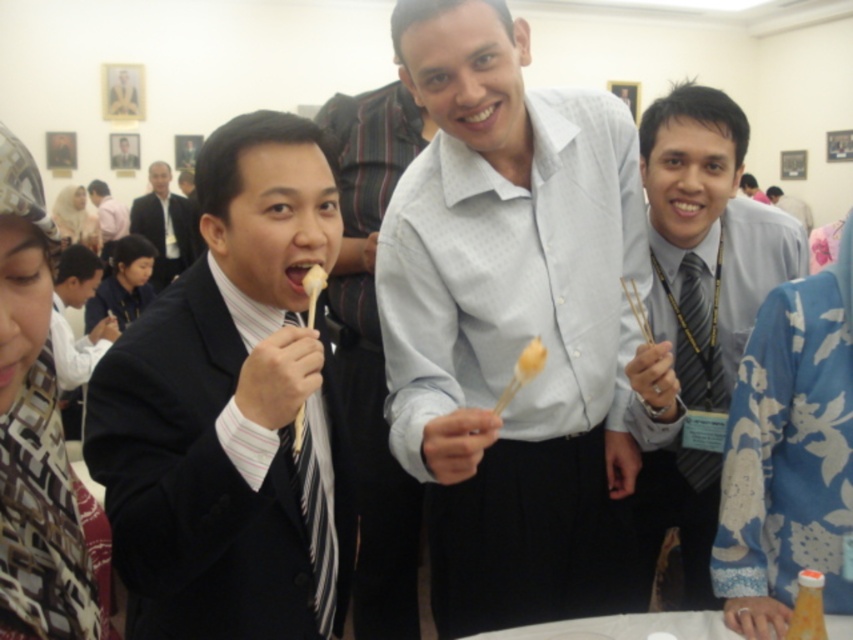
Does point (160, 275) come farther from viewer compared to point (534, 349)?

Yes, point (160, 275) is behind point (534, 349).

At what (x,y) coordinates should I click in order to perform the action: click on black suit at center. Please return your answer as a coordinate pair (x, y). Looking at the image, I should click on (166, 227).

The height and width of the screenshot is (640, 853). I want to click on black suit at center, so click(166, 227).

Is light blue shirt at center below yellow matte skewer at center?

Yes, light blue shirt at center is below yellow matte skewer at center.

Is point (618, 401) farther from camera compared to point (543, 360)?

Yes.

Does point (546, 604) lie in front of point (523, 360)?

No.

Find the location of a particular element. light blue shirt at center is located at coordinates (511, 323).

Who is higher up, gray striped tie at right or white shirt at center?

white shirt at center is above.

Who is more forward, [653,253] or [781,195]?

Positioned in front is point [653,253].

Where is `gray striped tie at right`? gray striped tie at right is located at coordinates (697, 310).